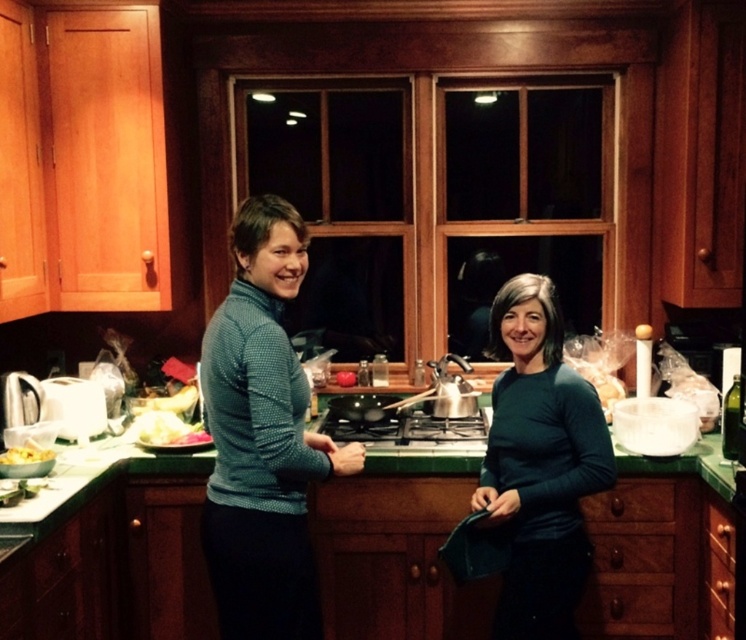
Question: Among these points, which one is farthest from the camera?

Choices:
 (A) (601, 509)
 (B) (586, 449)
 (C) (13, 449)

Answer: (A)

Question: Observing the image, what is the correct spatial positioning of blue dotted sweater at center in reference to teal dotted sweater at center?

Choices:
 (A) right
 (B) left

Answer: (B)

Question: Among these objects, which one is farthest from the camera?

Choices:
 (A) blue dotted sweater at center
 (B) teal dotted sweater at center
 (C) yellow matte pasta at lower left

Answer: (C)

Question: Does blue dotted sweater at center have a larger size compared to dark green sweater at center?

Choices:
 (A) no
 (B) yes

Answer: (A)

Question: Which point is closer to the camera?

Choices:
 (A) (715, 554)
 (B) (236, 269)
 (C) (251, 292)

Answer: (C)

Question: Can you confirm if green marble countertop at center is thinner than dark green sweater at center?

Choices:
 (A) no
 (B) yes

Answer: (A)